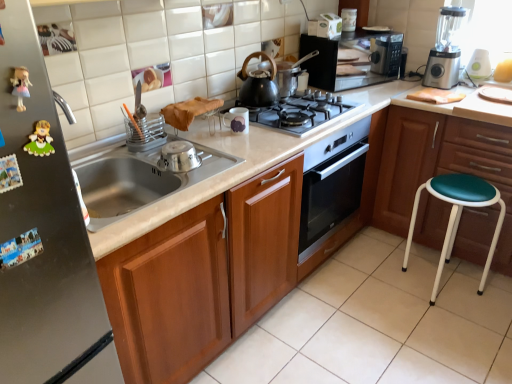
At what (x,y) coordinates should I click in order to perform the action: click on free point in front of white glossy mug at upper center, which is counted as the 2th appliance, starting from the right. Please return your answer as a coordinate pair (x, y). Looking at the image, I should click on (240, 144).